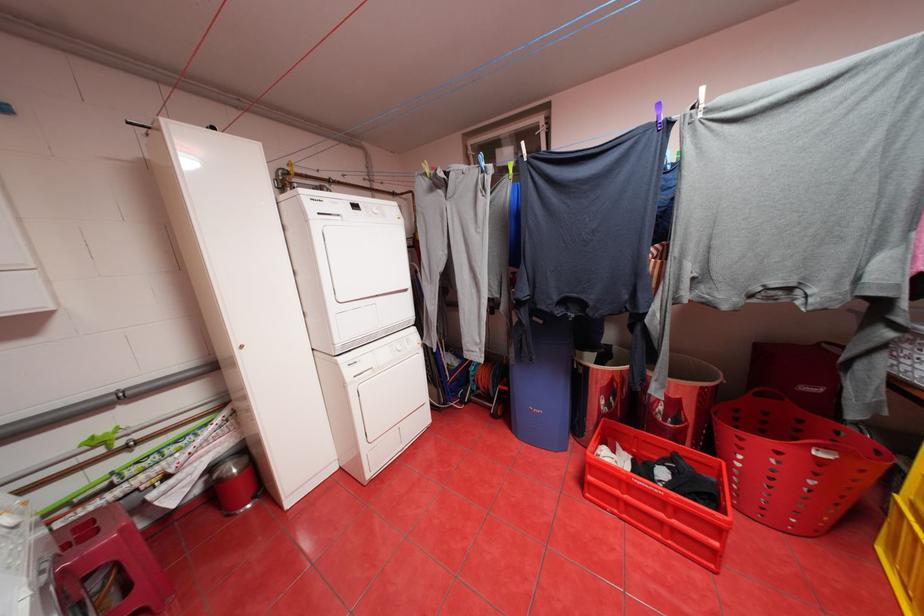
The width and height of the screenshot is (924, 616). Find the location of `light blue clothespin`. light blue clothespin is located at coordinates (479, 160).